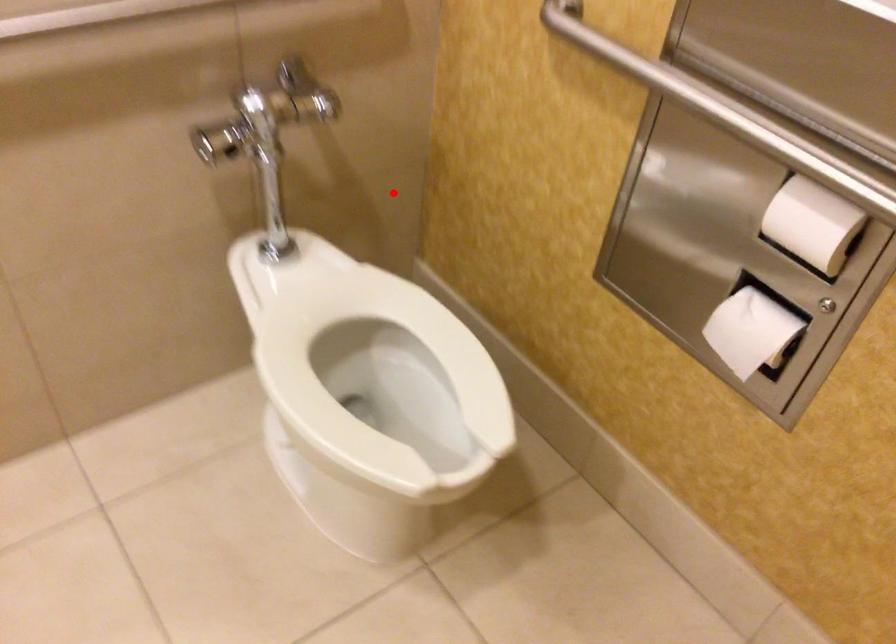
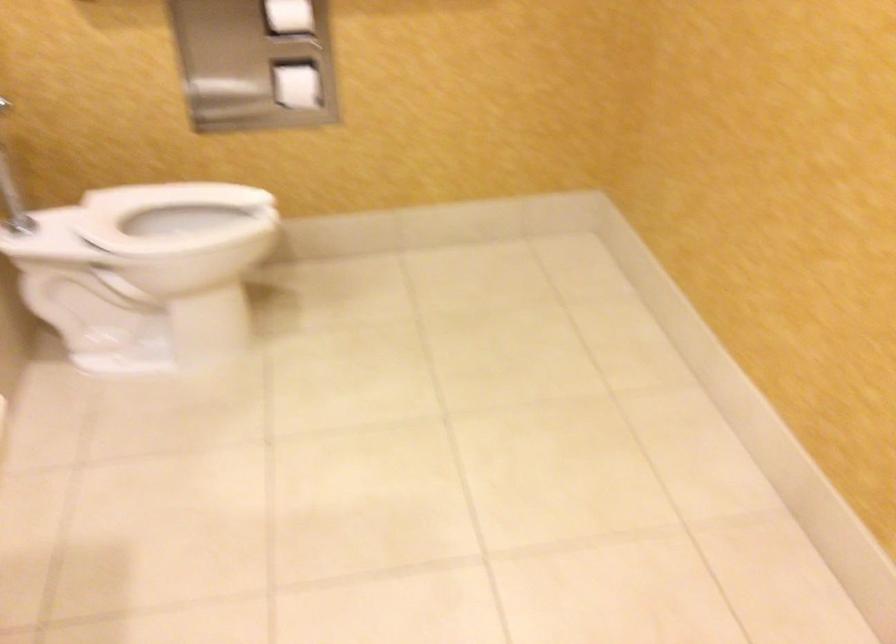
Question: I am providing you with two images of the same scene from different viewpoints. A red point is marked on the first image. Can you still see the location of the red point in image 2?

Choices:
 (A) Yes
 (B) No

Answer: (A)